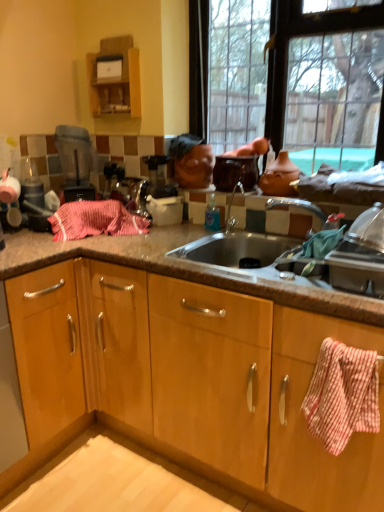
Question: Is glossy ceramic pot at upper center, the 1th appliance when ordered from right to left, wider or thinner than red checkered towel at right, which is the second cabinetry from back to front?

Choices:
 (A) thin
 (B) wide

Answer: (B)

Question: Considering the positions of glossy ceramic pot at upper center, which is counted as the 2th appliance, starting from the left, and red checkered towel at right, which is the second cabinetry from back to front, in the image, is glossy ceramic pot at upper center, which is counted as the 2th appliance, starting from the left, bigger or smaller than red checkered towel at right, which is the second cabinetry from back to front,?

Choices:
 (A) big
 (B) small

Answer: (A)

Question: Which object is the closest to the matte glass window at upper center?

Choices:
 (A) pink woven towel at center
 (B) glossy ceramic pot at upper center, the 1th appliance when ordered from right to left
 (C) wooden cabinet at upper left, which appears as the 2th cabinetry when viewed from the front
 (D) matte black blender at upper left, the 1th appliance positioned from the left
 (E) red checkered towel at right, which is counted as the 1th cabinetry, starting from the front

Answer: (B)

Question: Which object is positioned closest to the matte glass window at upper center?

Choices:
 (A) pink woven towel at center
 (B) glossy ceramic pot at upper center, the 1th appliance when ordered from right to left
 (C) red checkered towel at right, acting as the 1th cabinetry starting from the bottom
 (D) matte black blender at upper left, which appears as the 2th appliance when viewed from the right
 (E) wooden cabinet at upper left, which ranks as the first cabinetry in top-to-bottom order

Answer: (B)